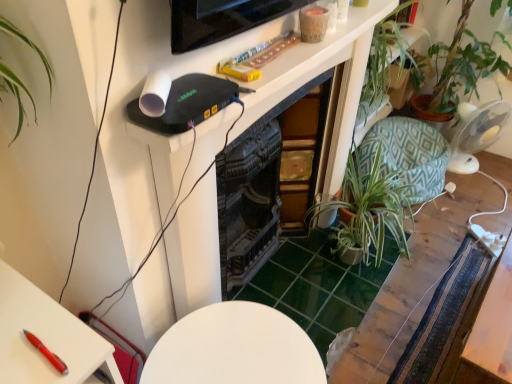
Locate an element on the screen. green leafy plant at center-right is located at coordinates (370, 209).

Measure the distance between point (x=469, y=139) and camera.

A distance of 7.85 feet exists between point (x=469, y=139) and camera.

What is the approximate width of green leafy plant at right?

12.28 inches.

Find the location of `wooden table at lower right, marked as the second table in a back-to-front arrangement`. wooden table at lower right, marked as the second table in a back-to-front arrangement is located at coordinates (493, 327).

Does point (388, 172) come closer to viewer compared to point (461, 183)?

Yes, point (388, 172) is closer to viewer.

From the image's perspective, is teal geometric fabric swivel chair at right below wooden table at center, which ranks as the 3th table in front-to-back order?

No.

Would you say teal geometric fabric swivel chair at right is a long distance from wooden table at center, which is counted as the first table, starting from the back?

No, teal geometric fabric swivel chair at right is not far away from wooden table at center, which is counted as the first table, starting from the back.

Between teal geometric fabric swivel chair at right and wooden table at center, which ranks as the 3th table in front-to-back order, which one has larger size?

teal geometric fabric swivel chair at right is bigger.

Considering the sizes of objects teal geometric fabric swivel chair at right and green leafy plant at right in the image provided, who is wider, teal geometric fabric swivel chair at right or green leafy plant at right?

teal geometric fabric swivel chair at right.

From the image's perspective, is teal geometric fabric swivel chair at right located beneath green leafy plant at right?

Yes.

From a real-world perspective, is teal geometric fabric swivel chair at right positioned above or below green leafy plant at right?

In terms of real-world spatial position, teal geometric fabric swivel chair at right is below green leafy plant at right.

In the scene shown: Considering the sizes of wooden table at lower right, marked as the second table in a back-to-front arrangement, and transparent plastic fan at right in the image, is wooden table at lower right, marked as the second table in a back-to-front arrangement, bigger or smaller than transparent plastic fan at right?

In the image, wooden table at lower right, marked as the second table in a back-to-front arrangement, appears to be larger than transparent plastic fan at right.

From the image's perspective, relative to transparent plastic fan at right, is wooden table at lower right, the 2th table when ordered from front to back, above or below?

wooden table at lower right, the 2th table when ordered from front to back, is below transparent plastic fan at right.

What's the angular difference between wooden table at lower right, marked as the second table in a back-to-front arrangement, and transparent plastic fan at right's facing directions?

The angular difference between wooden table at lower right, marked as the second table in a back-to-front arrangement, and transparent plastic fan at right is 113 degrees.

From a real-world perspective, who is located higher, wooden table at center, which is counted as the first table, starting from the back, or teal geometric fabric swivel chair at right?

teal geometric fabric swivel chair at right is physically above.

Considering the relative sizes of wooden table at center, which is counted as the first table, starting from the back, and teal geometric fabric swivel chair at right in the image provided, is wooden table at center, which is counted as the first table, starting from the back, smaller than teal geometric fabric swivel chair at right?

Yes, wooden table at center, which is counted as the first table, starting from the back, is smaller than teal geometric fabric swivel chair at right.

Between wooden table at center, which is counted as the first table, starting from the back, and transparent plastic fan at right, which one appears on the right side from the viewer's perspective?

From the viewer's perspective, transparent plastic fan at right appears more on the right side.

Is wooden table at center, which is counted as the first table, starting from the back, spatially inside transparent plastic fan at right, or outside of it?

wooden table at center, which is counted as the first table, starting from the back, is spatially situated outside transparent plastic fan at right.

Considering the sizes of objects wooden table at center, which is counted as the first table, starting from the back, and transparent plastic fan at right in the image provided, who is thinner, wooden table at center, which is counted as the first table, starting from the back, or transparent plastic fan at right?

Thinner between the two is transparent plastic fan at right.

Who is taller, wooden table at center, which ranks as the 3th table in front-to-back order, or transparent plastic fan at right?

With more height is transparent plastic fan at right.

Is green leafy plant at center-right directly adjacent to white glossy table at center, which appears as the 3th table when viewed from the back?

green leafy plant at center-right and white glossy table at center, which appears as the 3th table when viewed from the back, are clearly separated.

At what (x,y) coordinates should I click in order to perform the action: click on houseplant that appears behind the white glossy table at center, which appears as the 3th table when viewed from the back. Please return your answer as a coordinate pair (x, y). This screenshot has height=384, width=512. Looking at the image, I should click on (370, 209).

Does green leafy plant at center-right turn towards white glossy table at center, marked as the 1th table in a front-to-back arrangement?

No, green leafy plant at center-right does not turn towards white glossy table at center, marked as the 1th table in a front-to-back arrangement.

From a real-world perspective, is green leafy plant at right physically located above or below wooden table at lower right, the 2th table when ordered from front to back?

In terms of real-world spatial position, green leafy plant at right is above wooden table at lower right, the 2th table when ordered from front to back.

Where is `the 2nd table in front of the green leafy plant at right, counting from the anchor's position`? This screenshot has height=384, width=512. the 2nd table in front of the green leafy plant at right, counting from the anchor's position is located at coordinates (493, 327).

What's the angular difference between green leafy plant at right and wooden table at lower right, marked as the second table in a back-to-front arrangement,'s facing directions?

The facing directions of green leafy plant at right and wooden table at lower right, marked as the second table in a back-to-front arrangement, are 86.6 degrees apart.

Is green leafy plant at right inside or outside of wooden table at lower right, the 2th table when ordered from front to back?

green leafy plant at right is not enclosed by wooden table at lower right, the 2th table when ordered from front to back.

This screenshot has width=512, height=384. I want to click on the 2nd table to the left of the teal geometric fabric swivel chair at right, counting from the anchor's position, so click(415, 273).

The width and height of the screenshot is (512, 384). I want to click on swivel chair on the right of green leafy plant at right, so click(x=407, y=155).

Based on their spatial positions, is wooden table at lower right, marked as the second table in a back-to-front arrangement, or teal geometric fabric swivel chair at right further from wooden table at center, which ranks as the 3th table in front-to-back order?

wooden table at lower right, marked as the second table in a back-to-front arrangement.

Looking at the image, which one is located closer to white glossy table at center, which appears as the 3th table when viewed from the back, wooden table at center, which ranks as the 3th table in front-to-back order, or transparent plastic fan at right?

Among the two, wooden table at center, which ranks as the 3th table in front-to-back order, is located nearer to white glossy table at center, which appears as the 3th table when viewed from the back.

Which object lies further to the anchor point wooden table at lower right, the 2th table when ordered from front to back, wooden table at center, which is counted as the first table, starting from the back, or transparent plastic fan at right?

transparent plastic fan at right lies further to wooden table at lower right, the 2th table when ordered from front to back, than the other object.

Considering their positions, is wooden table at lower right, marked as the second table in a back-to-front arrangement, positioned closer to wooden table at center, which ranks as the 3th table in front-to-back order, than green leafy plant at center-right?

green leafy plant at center-right is positioned closer to the anchor wooden table at center, which ranks as the 3th table in front-to-back order.

Estimate the real-world distances between objects in this image. Which object is further from wooden table at center, which is counted as the first table, starting from the back, teal geometric fabric swivel chair at right or transparent plastic fan at right?

transparent plastic fan at right.

Based on their spatial positions, is wooden table at lower right, the 2th table when ordered from front to back, or wooden table at center, which is counted as the first table, starting from the back, closer to white glossy table at center, which appears as the 3th table when viewed from the back?

Based on the image, wooden table at lower right, the 2th table when ordered from front to back, appears to be nearer to white glossy table at center, which appears as the 3th table when viewed from the back.

Looking at the image, which one is located closer to green leafy plant at right, white glossy table at center, which appears as the 3th table when viewed from the back, or wooden table at center, which is counted as the first table, starting from the back?

The object closer to green leafy plant at right is wooden table at center, which is counted as the first table, starting from the back.

Considering their positions, is green leafy plant at right positioned further to transparent plastic fan at right than green leafy plant at center-right?

The object further to transparent plastic fan at right is green leafy plant at center-right.

Where is `houseplant located between wooden table at lower right, marked as the second table in a back-to-front arrangement, and transparent plastic fan at right in the depth direction`? The width and height of the screenshot is (512, 384). houseplant located between wooden table at lower right, marked as the second table in a back-to-front arrangement, and transparent plastic fan at right in the depth direction is located at coordinates click(370, 209).

Where is `houseplant between white glossy table at center, marked as the 1th table in a front-to-back arrangement, and wooden table at center, which is counted as the first table, starting from the back, from left to right`? The image size is (512, 384). houseplant between white glossy table at center, marked as the 1th table in a front-to-back arrangement, and wooden table at center, which is counted as the first table, starting from the back, from left to right is located at coordinates (370, 209).

Where is `vegetation between wooden table at center, which is counted as the first table, starting from the back, and transparent plastic fan at right, along the z-axis`? The height and width of the screenshot is (384, 512). vegetation between wooden table at center, which is counted as the first table, starting from the back, and transparent plastic fan at right, along the z-axis is located at coordinates (384, 62).

The height and width of the screenshot is (384, 512). What are the coordinates of `houseplant between wooden table at lower right, marked as the second table in a back-to-front arrangement, and teal geometric fabric swivel chair at right in the front-back direction` in the screenshot? It's located at (370, 209).